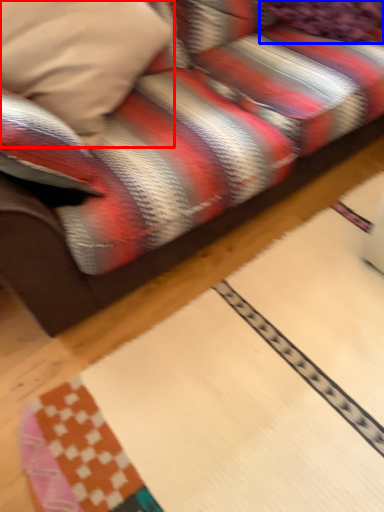
Question: Which object appears closest to the camera in this image, pillow (highlighted by a red box) or pillow (highlighted by a blue box)?

Choices:
 (A) pillow
 (B) pillow

Answer: (A)